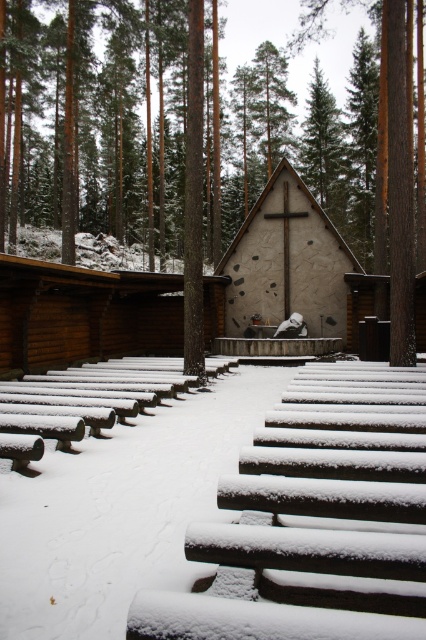
In the scene shown: You are standing in front of the chapel and want to walk from the brown wooden cabin at center to the stucco cross at center. Which direction should you move towards?

The brown wooden cabin at center is to the left of stucco cross at center, so you should move towards the right to reach the stucco cross at center.